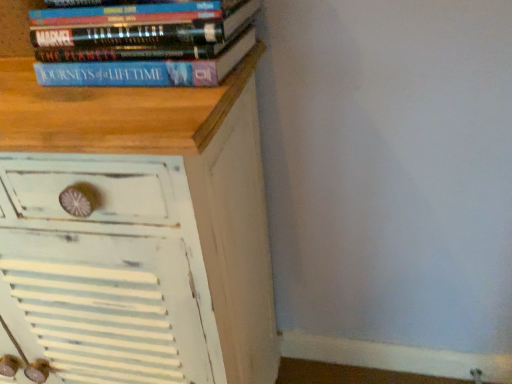
Question: Is white distressed wood chest of drawers at upper left located within blue matte book at upper left?

Choices:
 (A) no
 (B) yes

Answer: (A)

Question: Considering the relative sizes of blue matte book at upper left and white distressed wood chest of drawers at upper left in the image provided, is blue matte book at upper left thinner than white distressed wood chest of drawers at upper left?

Choices:
 (A) yes
 (B) no

Answer: (A)

Question: Is blue matte book at upper left facing towards white distressed wood chest of drawers at upper left?

Choices:
 (A) no
 (B) yes

Answer: (A)

Question: From a real-world perspective, does blue matte book at upper left stand above white distressed wood chest of drawers at upper left?

Choices:
 (A) no
 (B) yes

Answer: (B)

Question: Are blue matte book at upper left and white distressed wood chest of drawers at upper left located far from each other?

Choices:
 (A) no
 (B) yes

Answer: (A)

Question: Is blue matte book at upper left not inside white distressed wood chest of drawers at upper left?

Choices:
 (A) no
 (B) yes

Answer: (B)

Question: Is white distressed wood chest of drawers at upper left facing away from blue matte book at upper left?

Choices:
 (A) no
 (B) yes

Answer: (A)

Question: Can you confirm if white distressed wood chest of drawers at upper left is positioned to the left of blue matte book at upper left?

Choices:
 (A) no
 (B) yes

Answer: (B)

Question: From a real-world perspective, is white distressed wood chest of drawers at upper left positioned under blue matte book at upper left based on gravity?

Choices:
 (A) no
 (B) yes

Answer: (B)

Question: Is blue matte book at upper left inside white distressed wood chest of drawers at upper left?

Choices:
 (A) yes
 (B) no

Answer: (B)

Question: Is white distressed wood chest of drawers at upper left thinner than blue matte book at upper left?

Choices:
 (A) no
 (B) yes

Answer: (A)

Question: Is white distressed wood chest of drawers at upper left not within blue matte book at upper left?

Choices:
 (A) no
 (B) yes

Answer: (B)

Question: From the image's perspective, is blue matte book at upper left positioned above or below white distressed wood chest of drawers at upper left?

Choices:
 (A) below
 (B) above

Answer: (B)